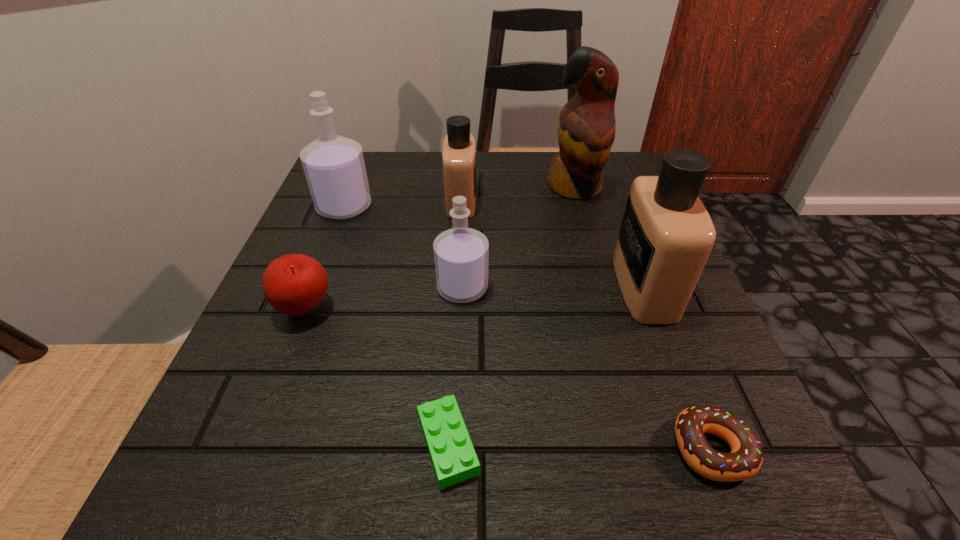
This screenshot has height=540, width=960. In order to click on apple in this screenshot , I will do `click(295, 284)`.

Identify the location of red apple. The height and width of the screenshot is (540, 960). (295, 284).

In order to click on the seventh tallest object in this screenshot , I will do `click(745, 460)`.

The width and height of the screenshot is (960, 540). Find the location of `doughnut`. doughnut is located at coordinates (745, 460).

In order to click on green Lego in this screenshot , I will do `click(454, 459)`.

This screenshot has height=540, width=960. I want to click on Lego, so click(454, 459).

The image size is (960, 540). I want to click on free location located on the face of the tallest object, so click(x=612, y=319).

Locate an element on the screen. The width and height of the screenshot is (960, 540). vacant position located 0.370m on the right of the bigger purple perfume is located at coordinates (547, 207).

The image size is (960, 540). What are the coordinates of `blank space located on the front label of the bigger beige perfume` in the screenshot? It's located at (408, 287).

I want to click on free space located on the front label of the bigger beige perfume, so click(x=485, y=287).